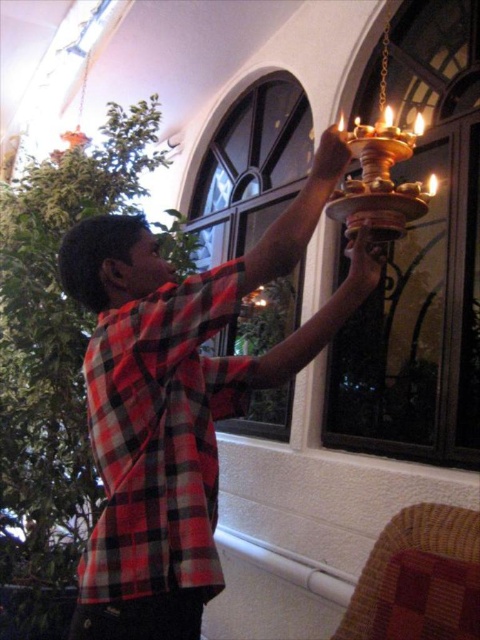
Question: Is red plaid shirt at center positioned behind red plaid shirt at upper center?

Choices:
 (A) no
 (B) yes

Answer: (A)

Question: Is red plaid shirt at center further to the viewer compared to red plaid shirt at upper center?

Choices:
 (A) no
 (B) yes

Answer: (A)

Question: Observing the image, what is the correct spatial positioning of red plaid shirt at center in reference to red plaid shirt at upper center?

Choices:
 (A) left
 (B) right

Answer: (A)

Question: Among these objects, which one is farthest from the camera?

Choices:
 (A) red plaid shirt at center
 (B) red plaid shirt at upper center

Answer: (B)

Question: Which of the following is the farthest from the observer?

Choices:
 (A) (191, 612)
 (B) (238, 376)

Answer: (B)

Question: Which point is closer to the camera taking this photo?

Choices:
 (A) (147, 416)
 (B) (160, 614)

Answer: (B)